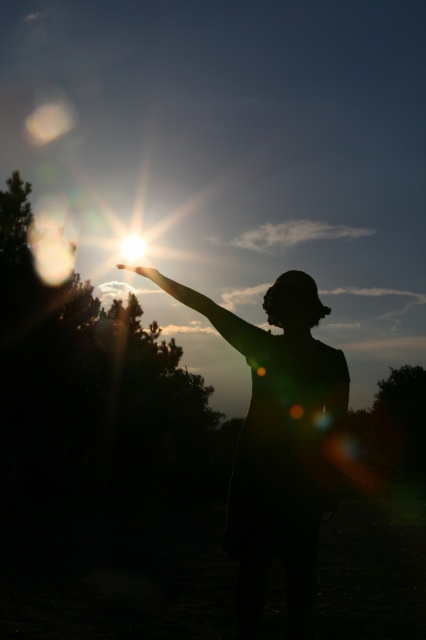
You are a photographer trying to capture the sunset scene. You notice two points in the image, one at coordinates point (244, 512) and another at point (149, 268). Which point is closer to your camera lens?

Point (244, 512) is closer to the viewer than point (149, 268).

Looking at this image, you are a photographer trying to capture the silhouette of a person pointing at the sun. Based on the scene, which object, the silhouette fabric at center or the silhouette arm at upper center, would appear taller in your photo?

The silhouette fabric at center is taller than the silhouette arm at upper center, so it would appear taller in the photo.

You are a photographer trying to capture the silhouette of a person pointing at the sun. You notice two elements in the scene, the silhouette fabric at center and the silhouette arm at upper center. Which one is closer to the camera?

The silhouette fabric at center is closer to the camera because it is in front of the silhouette arm at upper center.